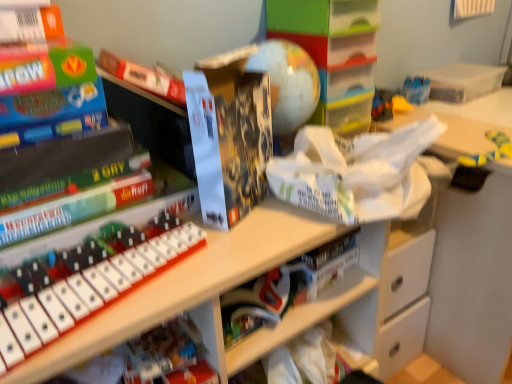
Question: From the image's perspective, is white plastic musical keyboard at center over clear plastic box at upper right?

Choices:
 (A) no
 (B) yes

Answer: (A)

Question: Can you confirm if white plastic musical keyboard at center is thinner than clear plastic box at upper right?

Choices:
 (A) yes
 (B) no

Answer: (B)

Question: Can you confirm if white plastic musical keyboard at center is positioned to the left of clear plastic box at upper right?

Choices:
 (A) yes
 (B) no

Answer: (A)

Question: Can you confirm if white plastic musical keyboard at center is taller than clear plastic box at upper right?

Choices:
 (A) no
 (B) yes

Answer: (A)

Question: Is white plastic musical keyboard at center oriented away from clear plastic box at upper right?

Choices:
 (A) no
 (B) yes

Answer: (A)

Question: Is clear plastic box at upper right wider or thinner than white matte book at center?

Choices:
 (A) thin
 (B) wide

Answer: (B)

Question: Looking at the image, does clear plastic box at upper right seem bigger or smaller compared to white matte book at center?

Choices:
 (A) big
 (B) small

Answer: (A)

Question: Is clear plastic box at upper right taller or shorter than white matte book at center?

Choices:
 (A) tall
 (B) short

Answer: (B)

Question: Which is correct: clear plastic box at upper right is inside white matte book at center, or outside of it?

Choices:
 (A) outside
 (B) inside

Answer: (A)

Question: Is point (205, 248) closer or farther from the camera than point (492, 137)?

Choices:
 (A) closer
 (B) farther

Answer: (A)

Question: Would you say white matte keyboard at center, which is the 2th shelf in top-to-bottom order, is inside or outside yellow rubber boot at right?

Choices:
 (A) inside
 (B) outside

Answer: (B)

Question: From a real-world perspective, is white matte keyboard at center, which is the 2th shelf in top-to-bottom order, physically located above or below yellow rubber boot at right?

Choices:
 (A) above
 (B) below

Answer: (B)

Question: From the image's perspective, is white matte keyboard at center, which is the 2th shelf in top-to-bottom order, above or below yellow rubber boot at right?

Choices:
 (A) below
 (B) above

Answer: (A)

Question: Is white matte keyboard at center, which is the first shelf from bottom to top, bigger or smaller than matte black lego box at center?

Choices:
 (A) small
 (B) big

Answer: (B)

Question: Does point (266, 241) appear closer or farther from the camera than point (247, 180)?

Choices:
 (A) farther
 (B) closer

Answer: (B)